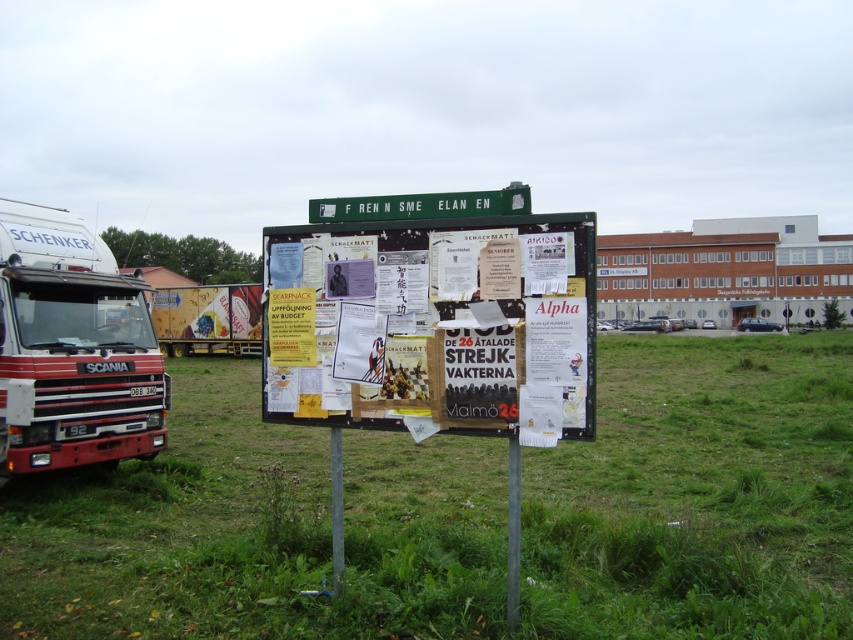
Who is shorter, paper posters at center or red matte truck at left?

Standing shorter between the two is paper posters at center.

Between paper posters at center and red matte truck at left, which one is positioned higher?

Positioned higher is red matte truck at left.

Locate an element on the screen. paper posters at center is located at coordinates (431, 321).

Who is more forward, (x=746, y=609) or (x=0, y=243)?

Positioned in front is point (x=746, y=609).

You are a GUI agent. You are given a task and a screenshot of the screen. Output one action in this format:
    pyautogui.click(x=<x>, y=<y>)
    Task: Click on the green grassy at left
    The height and width of the screenshot is (640, 853).
    Given the screenshot: What is the action you would take?
    pyautogui.click(x=257, y=531)

Does paper posters at center lie behind metallic silver truck at left?

No, paper posters at center is closer to the viewer.

Does paper posters at center appear on the left side of metallic silver truck at left?

In fact, paper posters at center is to the right of metallic silver truck at left.

Who is more forward, (277, 308) or (177, 336)?

Positioned in front is point (277, 308).

You are a GUI agent. You are given a task and a screenshot of the screen. Output one action in this format:
    pyautogui.click(x=<x>, y=<y>)
    Task: Click on the paper posters at center
    
    Given the screenshot: What is the action you would take?
    [x=431, y=321]